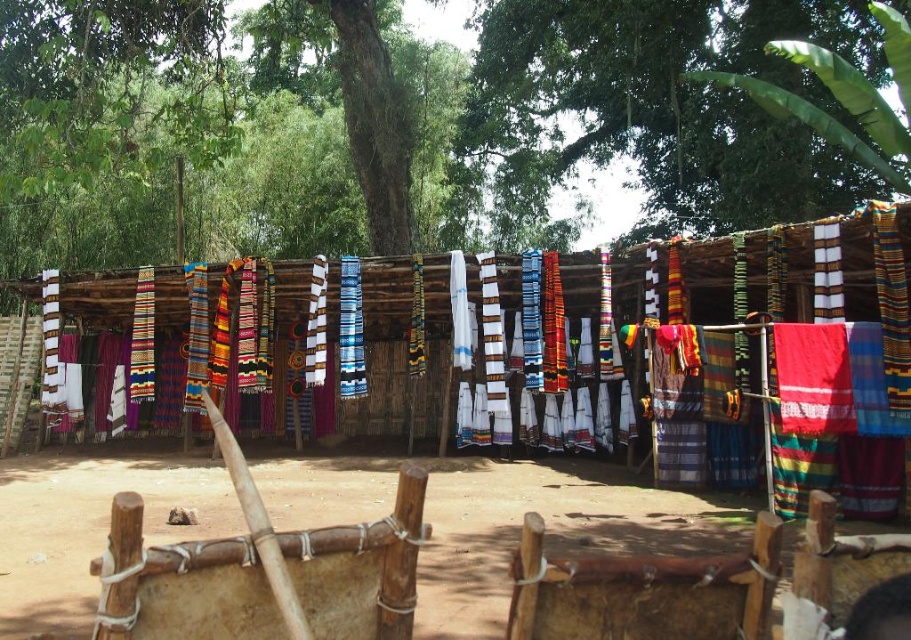
Which is above, textured woven cloth at center or brown dirt field at center?

Positioned higher is textured woven cloth at center.

From the picture: Is textured woven cloth at center to the left of brown dirt field at center from the viewer's perspective?

No, textured woven cloth at center is not to the left of brown dirt field at center.

What do you see at coordinates (763, 349) in the screenshot?
I see `textured woven cloth at center` at bounding box center [763, 349].

Where is `textured woven cloth at center`? Image resolution: width=911 pixels, height=640 pixels. textured woven cloth at center is located at coordinates (763, 349).

Can you confirm if textured woven cloth at center is positioned above green leafy tree at upper center?

No.

Can you confirm if textured woven cloth at center is shorter than green leafy tree at upper center?

Indeed, textured woven cloth at center has a lesser height compared to green leafy tree at upper center.

Where is `textured woven cloth at center`? textured woven cloth at center is located at coordinates (763, 349).

Where is `textured woven cloth at center`? textured woven cloth at center is located at coordinates (763, 349).

Is brown dirt field at center positioned behind green leafy tree at upper center?

No, brown dirt field at center is in front of green leafy tree at upper center.

Who is more forward, (480,490) or (482,76)?

Point (480,490)

The height and width of the screenshot is (640, 911). I want to click on brown dirt field at center, so click(499, 520).